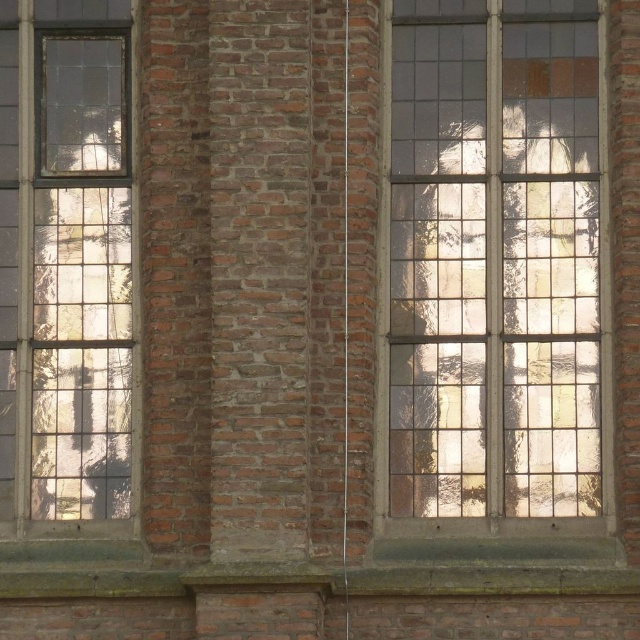
You are an architect examining the brick wall with two stained glass windows. You need to determine which window is shorter. Which stained glass window is shorter between the stained glass window at center and the stained glass window at left?

The stained glass window at center is shorter than the stained glass window at left.

You are an architect evaluating the symmetry of the brick wall with two stained glass windows. The stained glass window at center and the stained glass window at left are part of your analysis. Based on their widths, which window is wider?

The stained glass window at center is wider than the stained glass window at left.

You are standing in front of the brick wall with two stained glass windows. The windows are labeled as the stained glass window at center and the stained glass window at left. Which window is positioned lower on the wall?

The stained glass window at center is located below the stained glass window at left, so the stained glass window at center is positioned lower on the wall.